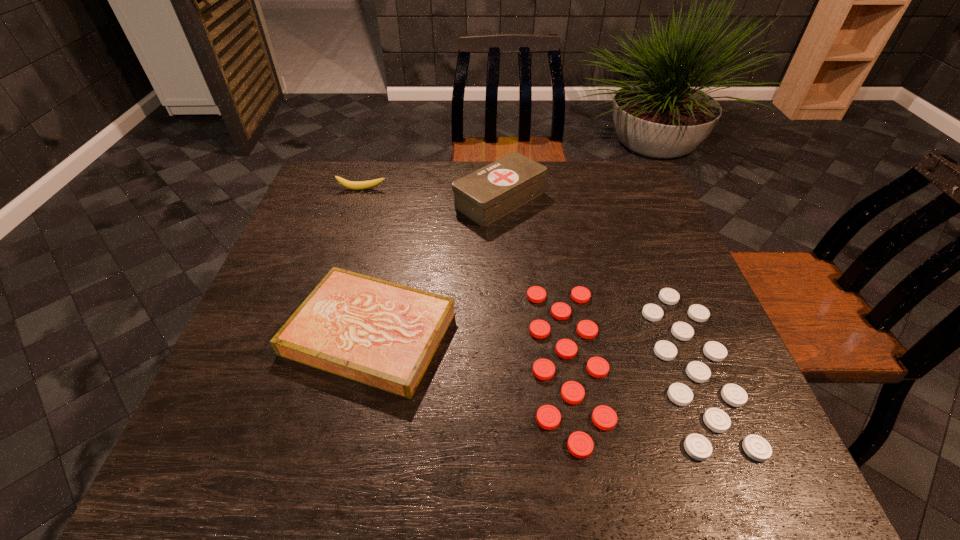
Locate an element on the screen. The height and width of the screenshot is (540, 960). free space at the far left corner is located at coordinates (361, 177).

Locate an element on the screen. vacant space at the far right corner of the desktop is located at coordinates (628, 164).

Locate an element on the screen. This screenshot has height=540, width=960. empty space between the hardback book and the tallest object is located at coordinates click(x=435, y=266).

Where is `free spot between the hardback book and the checkerboard`? This screenshot has width=960, height=540. free spot between the hardback book and the checkerboard is located at coordinates (500, 348).

Locate an element on the screen. unoccupied position between the shortest object and the banana is located at coordinates (496, 276).

The image size is (960, 540). I want to click on free space between the banana and the tallest object, so click(x=431, y=194).

Locate an element on the screen. Image resolution: width=960 pixels, height=540 pixels. vacant space that's between the tallest object and the checkerboard is located at coordinates (564, 281).

At what (x,y) coordinates should I click in order to perform the action: click on vacant space that is in between the checkerboard and the first-aid kit. Please return your answer as a coordinate pair (x, y). Looking at the image, I should click on (564, 281).

I want to click on vacant region between the tallest object and the banana, so click(x=431, y=194).

The image size is (960, 540). I want to click on empty space that is in between the tallest object and the checkerboard, so click(x=564, y=281).